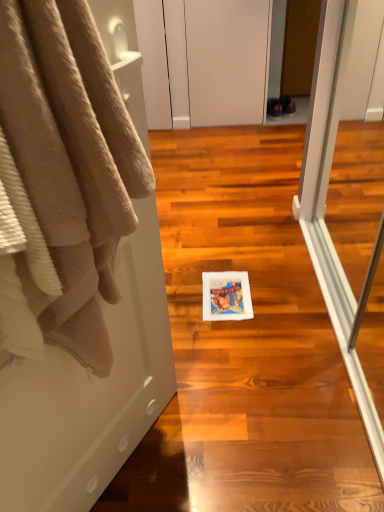
Question: From a real-world perspective, is white paper towel at center above or below white matte cabinet at upper center?

Choices:
 (A) below
 (B) above

Answer: (A)

Question: Looking at the image, does white paper towel at center seem bigger or smaller compared to white matte cabinet at upper center?

Choices:
 (A) small
 (B) big

Answer: (B)

Question: Based on their relative distances, which object is farther from the white matte cabinet at upper center?

Choices:
 (A) beige plush towel at left
 (B) white paper towel at center

Answer: (A)

Question: Considering the real-world distances, which object is farthest from the white matte cabinet at upper center?

Choices:
 (A) white paper towel at center
 (B) beige plush towel at left

Answer: (B)